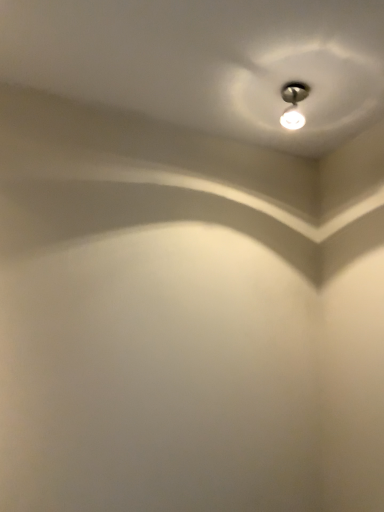
Identify the location of matte silver light bulb at upper center. (293, 104).

The width and height of the screenshot is (384, 512). Describe the element at coordinates (293, 104) in the screenshot. I see `matte silver light bulb at upper center` at that location.

In order to face matte silver light bulb at upper center, should I rotate leftwards or rightwards?

You should rotate right by 13.806 degrees.

Image resolution: width=384 pixels, height=512 pixels. I want to click on matte silver light bulb at upper center, so click(293, 104).